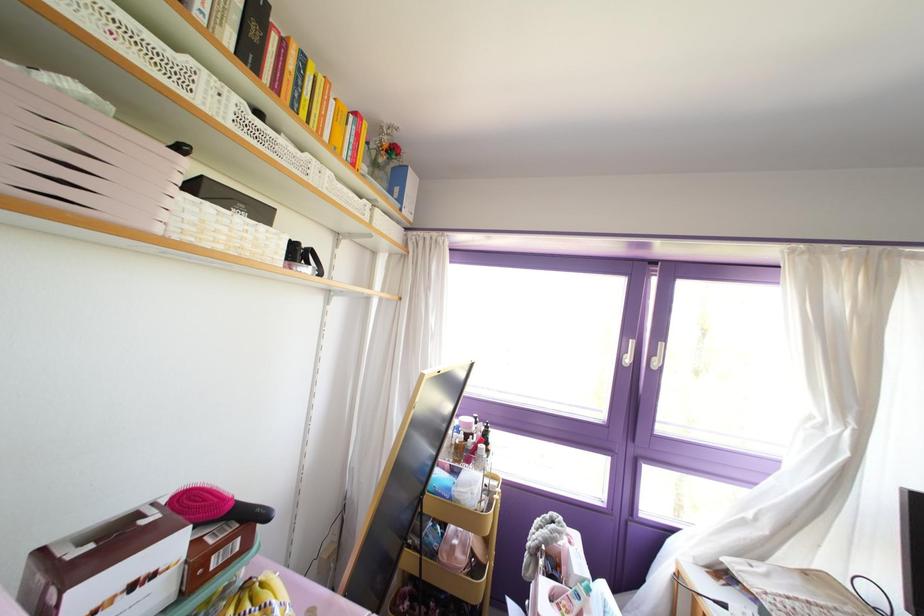
The location [214,506] corresponds to which object?

It corresponds to the pink hairbrush in the image.